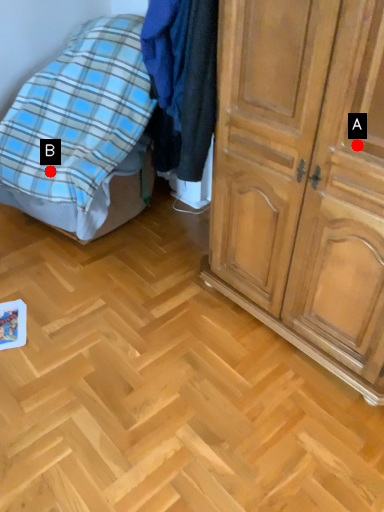
Question: Two points are circled on the image, labeled by A and B beside each circle. Which point is closer to the camera?

Choices:
 (A) A is closer
 (B) B is closer

Answer: (A)